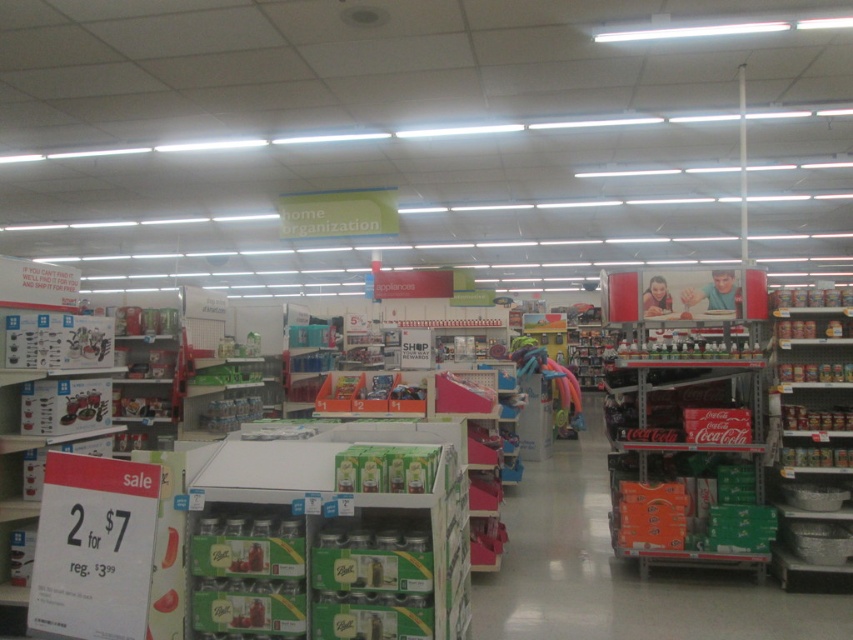
Question: Which point appears closest to the camera in this image?

Choices:
 (A) (828, 570)
 (B) (346, 616)

Answer: (B)

Question: Observing the image, what is the correct spatial positioning of green cardboard boxes at center in reference to metallic silver bowls at right?

Choices:
 (A) below
 (B) above

Answer: (B)

Question: Is green cardboard boxes at center above metallic silver bowls at right?

Choices:
 (A) yes
 (B) no

Answer: (A)

Question: Is green cardboard boxes at center in front of metallic silver bowls at right?

Choices:
 (A) no
 (B) yes

Answer: (B)

Question: Which point appears farthest from the camera in this image?

Choices:
 (A) (310, 493)
 (B) (825, 392)

Answer: (B)